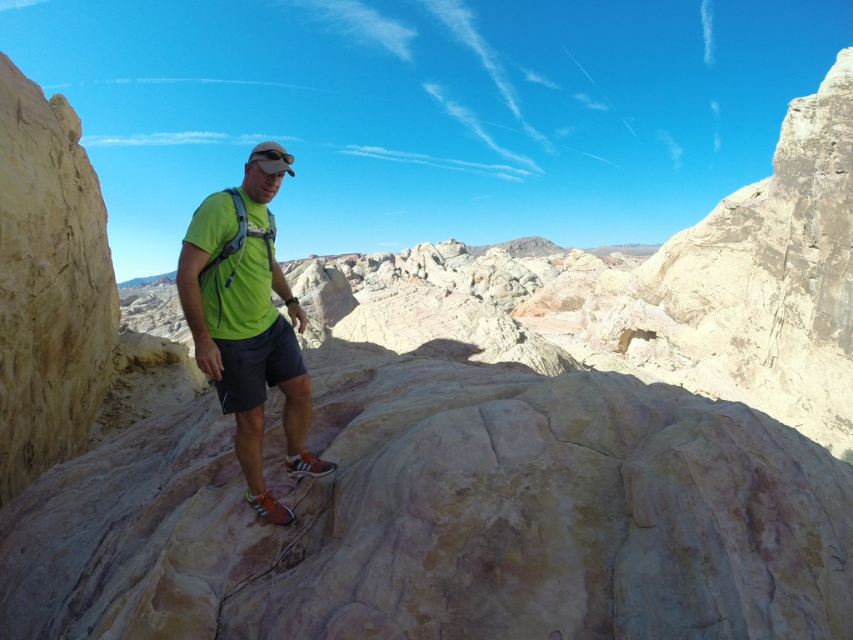
Question: Which point is farther to the camera?

Choices:
 (A) black cotton shorts at center
 (B) green matte shirt at center

Answer: (A)

Question: Is green matte shirt at center smaller than black cotton shorts at center?

Choices:
 (A) yes
 (B) no

Answer: (B)

Question: Does green matte shirt at center come behind black cotton shorts at center?

Choices:
 (A) yes
 (B) no

Answer: (B)

Question: Is green matte shirt at center below black cotton shorts at center?

Choices:
 (A) no
 (B) yes

Answer: (A)

Question: Among these objects, which one is nearest to the camera?

Choices:
 (A) green matte shirt at center
 (B) black cotton shorts at center

Answer: (A)